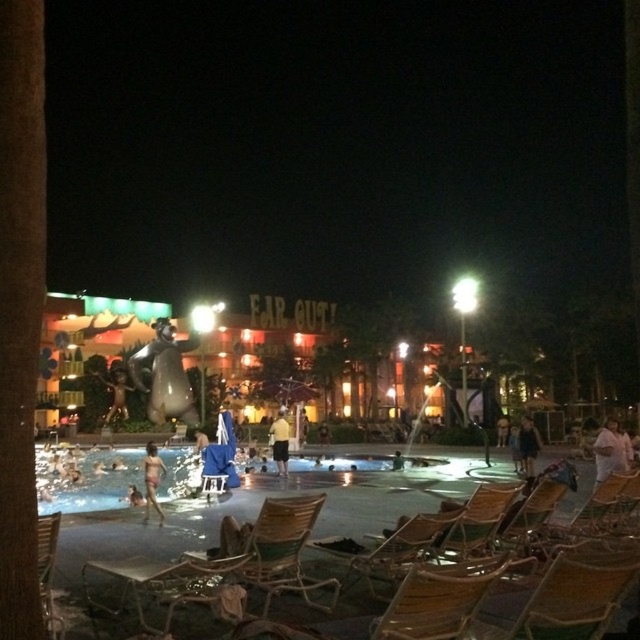
Question: Which object is farther from the camera taking this photo?

Choices:
 (A) clear plastic pool at center
 (B) wooden chair at lower left
 (C) dark blue dress at center
 (D) wooden textured beach chair at lower right

Answer: (C)

Question: Does metallic statue at center appear on the right side of dark blue fabric person at center?

Choices:
 (A) no
 (B) yes

Answer: (A)

Question: Does transparent plastic pool at lower left appear on the right side of metallic statue at center?

Choices:
 (A) yes
 (B) no

Answer: (A)

Question: Does white cotton shirt at lower right have a greater width compared to tan skin human at lower left?

Choices:
 (A) yes
 (B) no

Answer: (A)

Question: Which object is positioned closest to the dark blue fabric person at center?

Choices:
 (A) white cotton shirt at lower right
 (B) yellow cotton shorts at center

Answer: (B)

Question: Which object is closer to the camera taking this photo?

Choices:
 (A) wooden textured beach chair at lower right
 (B) metallic statue at center

Answer: (A)